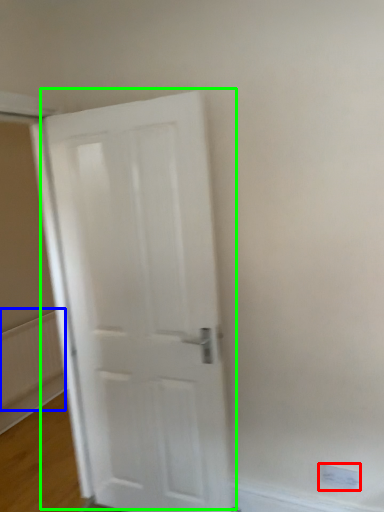
Question: Considering the real-world distances, which object is closest to electric outlet (highlighted by a red box)? radiator (highlighted by a blue box) or door (highlighted by a green box).

Choices:
 (A) radiator
 (B) door

Answer: (B)